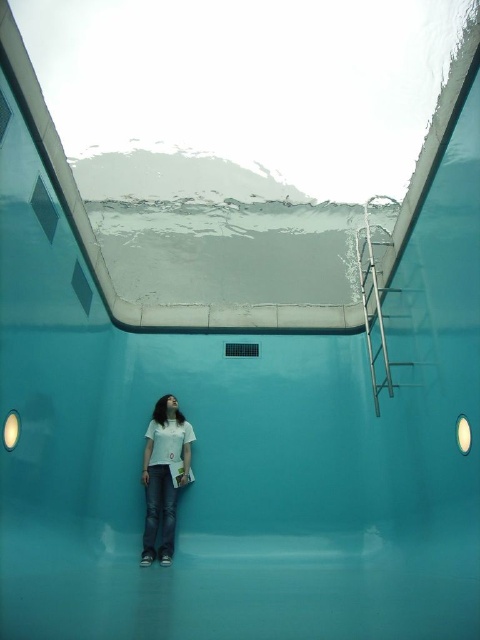
Question: Considering the relative positions of metallic silver ladder at upper right and white matte shirt at center in the image provided, where is metallic silver ladder at upper right located with respect to white matte shirt at center?

Choices:
 (A) above
 (B) below

Answer: (A)

Question: Does metallic silver ladder at upper right lie in front of white matte shirt at center?

Choices:
 (A) yes
 (B) no

Answer: (A)

Question: Is metallic silver ladder at upper right positioned before white matte shirt at center?

Choices:
 (A) no
 (B) yes

Answer: (B)

Question: Which of the following is the closest to the observer?

Choices:
 (A) (143, 460)
 (B) (389, 316)

Answer: (B)